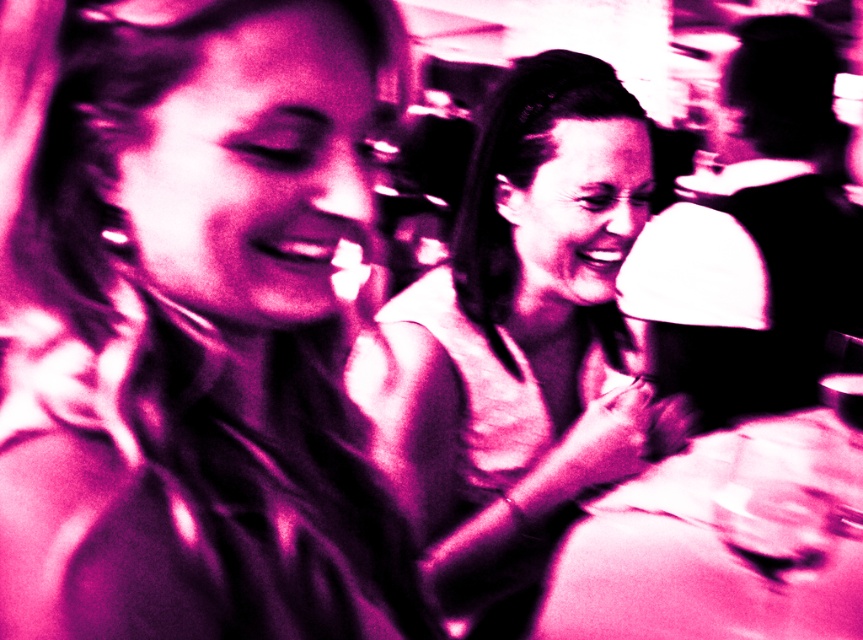
You are a photographer who wants to ensure that both the matte pink shirt at upper left and the transparent plastic wine glass at lower right are clearly visible in your photo. Given their sizes, which object should you focus on to ensure both are in focus?

The matte pink shirt at upper left occupies less space than the transparent plastic wine glass at lower right. To ensure both are in focus, you should focus on the transparent plastic wine glass at lower right since it is larger and will require more precise focus to capture details.

You are a photographer who wants to adjust the lighting to highlight both the matte pink shirt at upper left and the matte white blouse at center. Since the scene has a strong red filter, which object might need more adjustment to ensure it stands out against the background?

The matte white blouse at center might need more adjustment because it is positioned at the center and the strong red filter could make its white color blend into the background, whereas the matte pink shirt at upper left is already aligned with the dominant red tones of the scene.